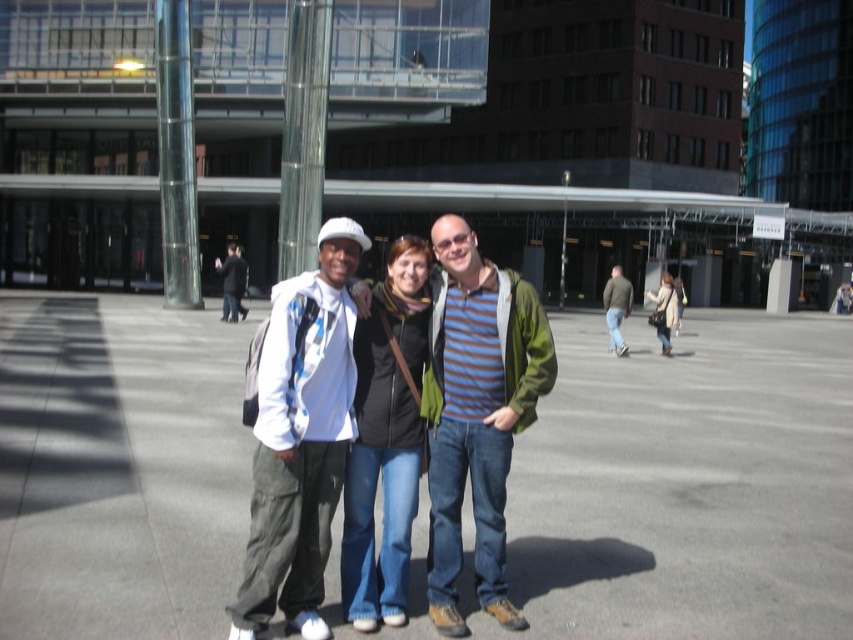
Question: Which point is closer to the camera?

Choices:
 (A) striped cotton shirt at center
 (B) green textured jacket at right
 (C) white matte jacket at left
 (D) black leather jacket at center

Answer: (C)

Question: Is matte white jacket at center thinner than striped cotton shirt at center?

Choices:
 (A) no
 (B) yes

Answer: (B)

Question: Which is nearer to the white cotton hoodie at center?

Choices:
 (A) green textured jacket at right
 (B) matte white jacket at center

Answer: (A)

Question: Among these points, which one is nearest to the camera?

Choices:
 (A) (654, 301)
 (B) (334, 321)
 (C) (368, 371)

Answer: (B)

Question: Is matte white jacket at center positioned before white matte jacket at left?

Choices:
 (A) no
 (B) yes

Answer: (A)

Question: Is white cotton hoodie at center thinner than light brown leather jacket at center?

Choices:
 (A) yes
 (B) no

Answer: (B)